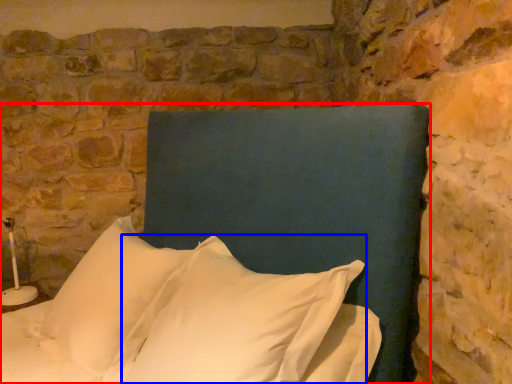
Question: Which point is further to the camera, bed (highlighted by a red box) or pillow (highlighted by a blue box)?

Choices:
 (A) bed
 (B) pillow

Answer: (B)